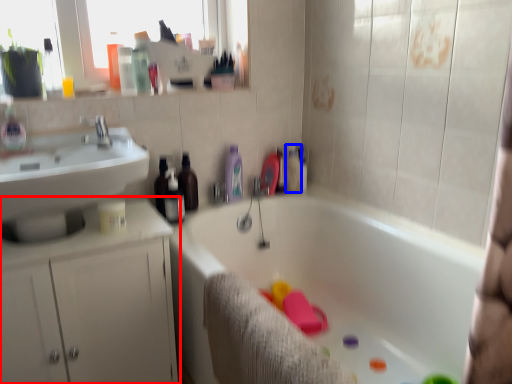
Question: Which object is further to the camera taking this photo, bathroom cabinet (highlighted by a red box) or toiletry (highlighted by a blue box)?

Choices:
 (A) bathroom cabinet
 (B) toiletry

Answer: (B)